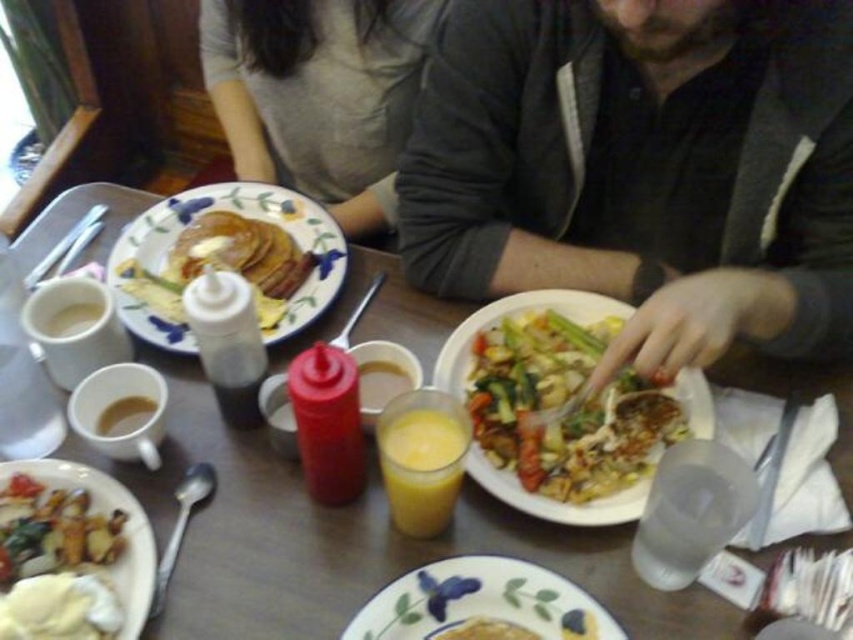
You are a waiter holding a tray of dishes. You need to place a new dessert plate on the table without moving any existing items. The dessert plate is 10 inches in diameter. Is there enough space between the porcelain plate with floral design at upper left and the nearest object to accommodate the dessert plate?

The porcelain plate with floral design at upper left is 29.96 inches away from the camera. However, the exact distance between it and the nearest object isn not provided. Without knowing the spacing between them, it is impossible to determine if the 10 inch dessert plate will fit.

You are a server at the restaurant and need to stack these items for cleaning. Can you place the white ceramic plate at center on top of the translucent glass juice at center without it tipping over?

The white ceramic plate at center has a lesser height compared to the translucent glass juice at center, so placing the plate on top would be unstable and likely cause it to tip over. The plate should be placed separately for safety.

In the scene shown: You are a waiter at the restaurant and need to place a new order of pancakes on the table. The customer requested the pancakes to be placed to the left of the juice. Can you confirm if the white ceramic plate at center currently holding the pancakes is in the correct position relative to the translucent glass juice at center?

The white ceramic plate at center is positioned on the right side of the translucent glass juice at center, so it is currently to the right, not the left. Therefore, the pancakes are not in the correct position as requested.